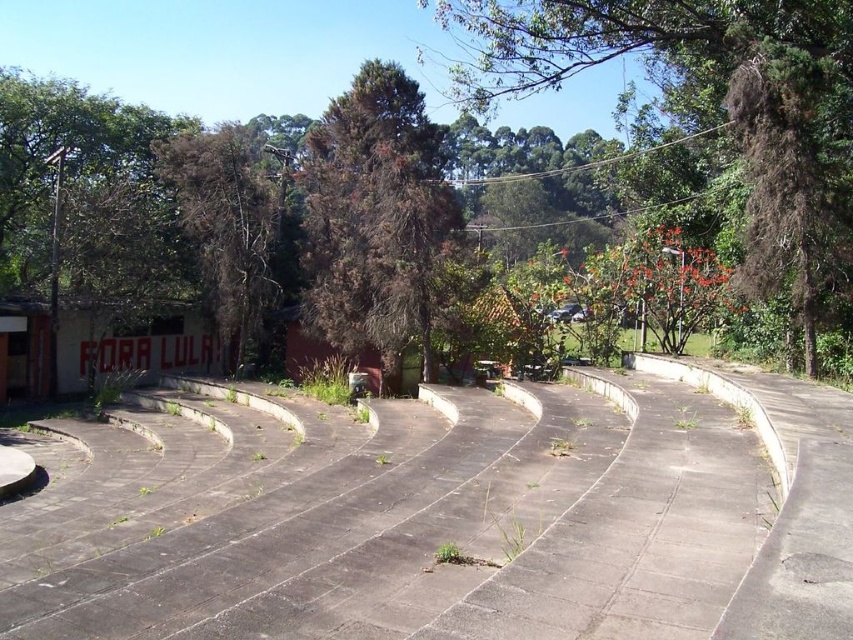
You are a photographer trying to capture the red painted concrete amphitheater at lower left without any obstructions. What should you do to ensure the green leafy tree at upper center does not block your view?

Move to a position where the green leafy tree at upper center is behind the red painted concrete amphitheater at lower left, as the tree is currently in front of the amphitheater.